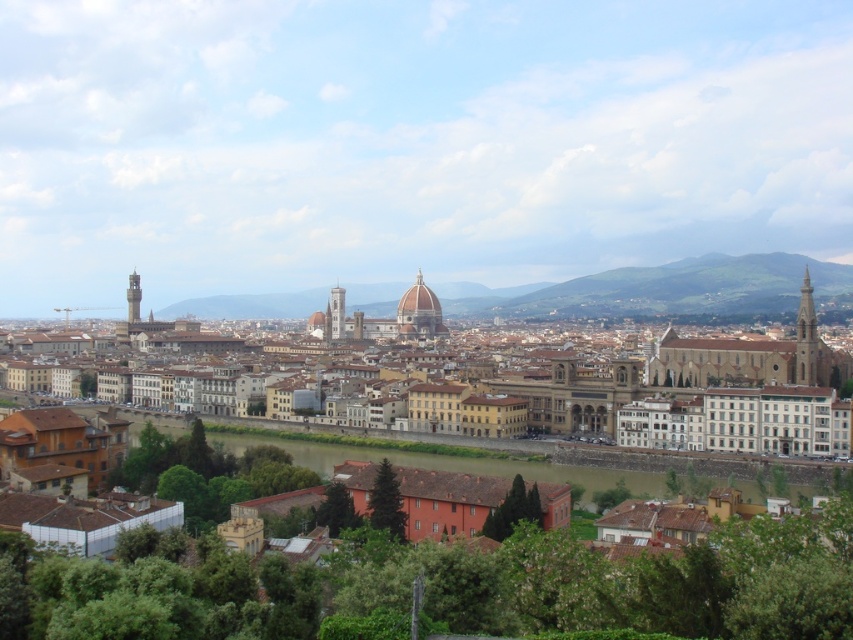
Question: Does brown stone hill at center appear under brown earthy river at center?

Choices:
 (A) yes
 (B) no

Answer: (B)

Question: Based on their relative distances, which object is nearer to the brown earthy river at center?

Choices:
 (A) brown stone hill at center
 (B) brown stone buildings at center

Answer: (B)

Question: Is brown stone hill at center further to camera compared to brown earthy river at center?

Choices:
 (A) no
 (B) yes

Answer: (B)

Question: Which point is closer to the camera?

Choices:
 (A) brown stone buildings at center
 (B) brown stone hill at center

Answer: (A)

Question: Can you confirm if brown stone buildings at center is thinner than brown stone hill at center?

Choices:
 (A) yes
 (B) no

Answer: (A)

Question: Which point appears farthest from the camera in this image?

Choices:
 (A) (525, 401)
 (B) (636, 465)
 (C) (811, 269)

Answer: (C)